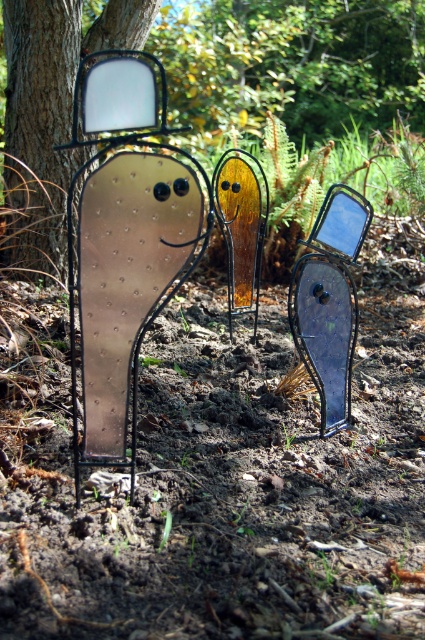
Consider the image. Between brushed metal tree at upper center and brushed metal mirror at left, which one is positioned lower?

brushed metal mirror at left is below.

Who is more forward, (271, 40) or (22, 81)?

Point (22, 81)

Image resolution: width=425 pixels, height=640 pixels. In order to click on brushed metal tree at upper center in this screenshot , I will do `click(218, 65)`.